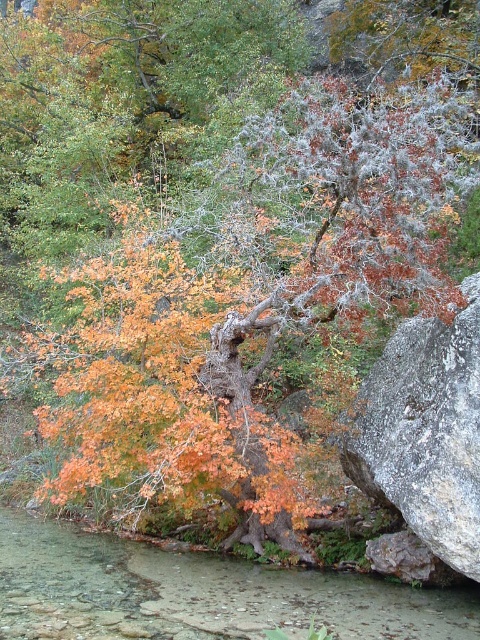
You are a hiker who needs to cross the clear glass stream at lower left to reach the gray rough rock at center. The stream is 1.98 meters wide. If your hiking boots are 2 meters wide, can you safely cross the stream without getting your boots wet?

The clear glass stream at lower left is 1.98 meters from gray rough rock at center. Since your hiking boots are 2 meters wide, they can span the stream, allowing you to cross safely without getting wet.

You are standing at the point with coordinates point (x=387, y=506) and want to walk towards the point with coordinates point (x=32, y=552). Will you be moving towards the tree or away from it?

Since point (x=32, y=552) is behind point (x=387, y=506), moving from point (x=387, y=506) towards point (x=32, y=552) would mean moving away from the tree.

You are standing near the tree and want to cross to the other side of the gray rough rock at center. The clear glass stream at lower left is in your path. Which direction should you move to avoid stepping into the stream?

To avoid stepping into the clear glass stream at lower left, you should move to the right side of the gray rough rock at center since the stream is on the left side of the rock.